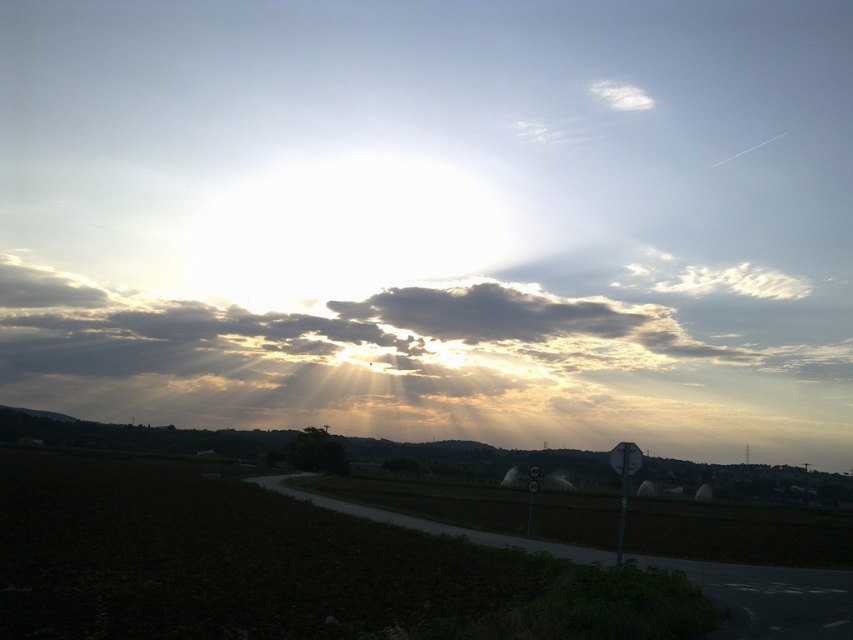
Is white plastic sign at right shorter than metallic reflective speed limit sign at lower right?

Correct, white plastic sign at right is not as tall as metallic reflective speed limit sign at lower right.

Between point (621, 522) and point (538, 468), which one is positioned in front?

Point (538, 468) is more forward.

What do you see at coordinates (624, 481) in the screenshot?
I see `white plastic sign at right` at bounding box center [624, 481].

You are a GUI agent. You are given a task and a screenshot of the screen. Output one action in this format:
    pyautogui.click(x=<x>, y=<y>)
    Task: Click on the white plastic sign at right
    This screenshot has width=853, height=640.
    Given the screenshot: What is the action you would take?
    pyautogui.click(x=624, y=481)

Which is more to the right, cloudy at upper center or white plastic sign at right?

From the viewer's perspective, cloudy at upper center appears more on the right side.

The height and width of the screenshot is (640, 853). Identify the location of cloudy at upper center. (537, 323).

Is cloudy at upper center to the left of metallic reflective speed limit sign at lower right from the viewer's perspective?

In fact, cloudy at upper center is to the right of metallic reflective speed limit sign at lower right.

The width and height of the screenshot is (853, 640). What do you see at coordinates (537, 323) in the screenshot? I see `cloudy at upper center` at bounding box center [537, 323].

Locate an element on the screen. Image resolution: width=853 pixels, height=640 pixels. cloudy at upper center is located at coordinates (537, 323).